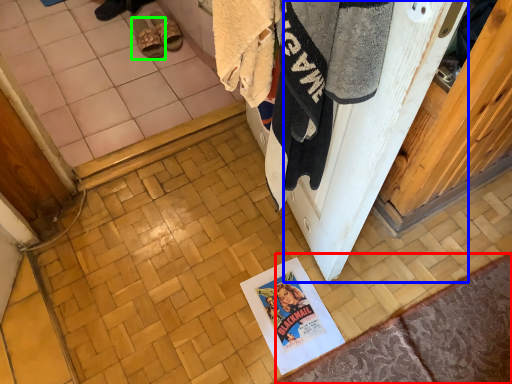
Question: Based on their relative distances, which object is nearer to doormat (highlighted by a red box)? Choose from screen door (highlighted by a blue box) and footwear (highlighted by a green box).

Choices:
 (A) screen door
 (B) footwear

Answer: (A)